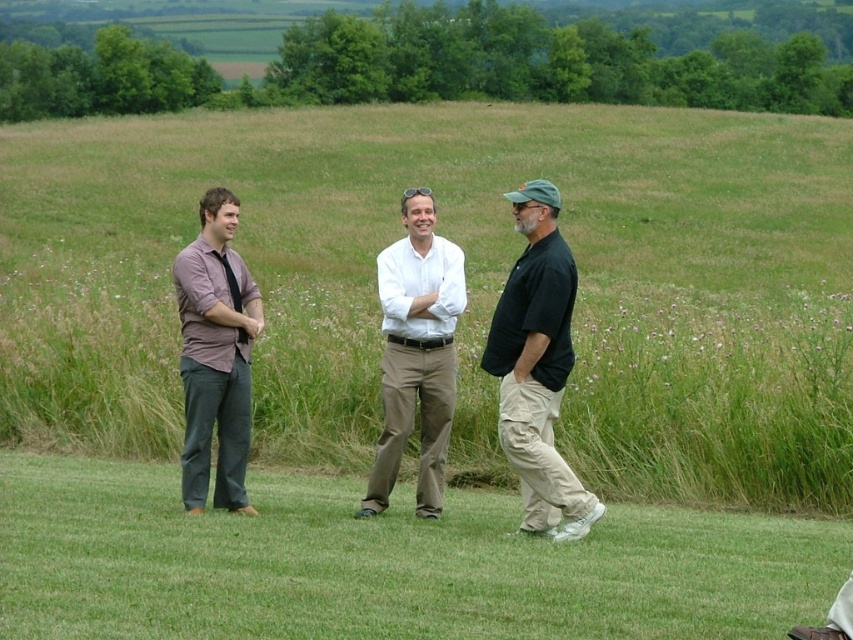
Question: Can you confirm if khaki pants at right is thinner than light brown cotton pants at center?

Choices:
 (A) yes
 (B) no

Answer: (A)

Question: Does khaki pants at right have a lesser width compared to light brown cotton pants at center?

Choices:
 (A) no
 (B) yes

Answer: (B)

Question: Which object appears closest to the camera in this image?

Choices:
 (A) matte purple shirt at left
 (B) light brown cotton pants at center
 (C) khaki pants at right

Answer: (C)

Question: Which object is positioned closest to the khaki pants at right?

Choices:
 (A) light brown cotton pants at center
 (B) matte purple shirt at left

Answer: (A)

Question: Does khaki pants at right have a lesser width compared to light brown cotton pants at center?

Choices:
 (A) yes
 (B) no

Answer: (A)

Question: Which point appears farthest from the camera in this image?

Choices:
 (A) (387, 282)
 (B) (524, 436)
 (C) (236, 218)

Answer: (A)